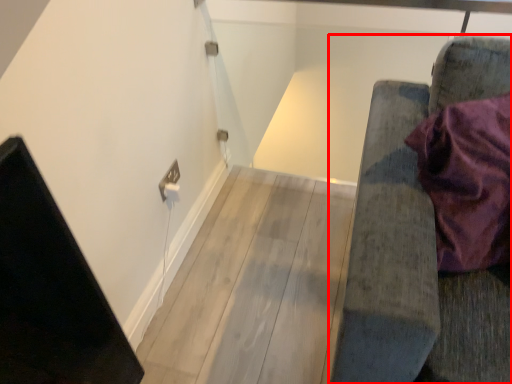
Question: From the image's perspective, what is the correct spatial relationship of furniture (annotated by the red box) in relation to electric outlet?

Choices:
 (A) above
 (B) below

Answer: (B)